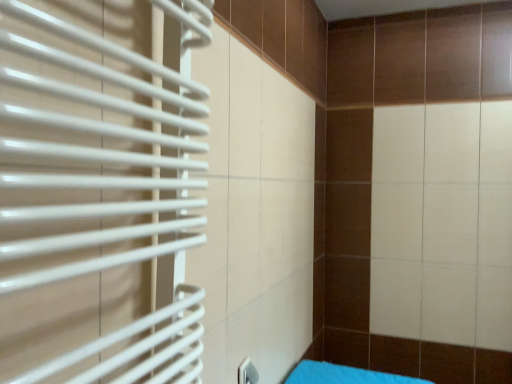
Measure the distance between point (161, 0) and camera.

The distance of point (161, 0) from camera is 79.20 centimeters.

The width and height of the screenshot is (512, 384). I want to click on white matte radiator at left, so tap(99, 193).

What is the approximate height of white matte radiator at left?

white matte radiator at left is 77.65 centimeters tall.

Describe the element at coordinates (99, 193) in the screenshot. The width and height of the screenshot is (512, 384). I see `white matte radiator at left` at that location.

What do you see at coordinates (344, 375) in the screenshot?
I see `blue fabric bed at lower right` at bounding box center [344, 375].

The height and width of the screenshot is (384, 512). Find the location of `blue fabric bed at lower right`. blue fabric bed at lower right is located at coordinates (344, 375).

You are a GUI agent. You are given a task and a screenshot of the screen. Output one action in this format:
    pyautogui.click(x=<x>, y=<y>)
    Task: Click on the white matte radiator at left
    The height and width of the screenshot is (384, 512).
    Given the screenshot: What is the action you would take?
    pyautogui.click(x=99, y=193)

Considering the relative positions of blue fabric bed at lower right and white matte radiator at left in the image provided, is blue fabric bed at lower right to the right of white matte radiator at left from the viewer's perspective?

Yes.

Considering the positions of objects blue fabric bed at lower right and white matte radiator at left in the image provided, who is behind, blue fabric bed at lower right or white matte radiator at left?

blue fabric bed at lower right is behind.

Which point is more distant from viewer, [365,375] or [128,351]?

The point [365,375] is farther from the camera.

From the image's perspective, is blue fabric bed at lower right under white matte radiator at left?

Yes.

Looking at this image, from a real-world perspective, does blue fabric bed at lower right stand above white matte radiator at left?

No, from a real-world perspective, blue fabric bed at lower right is not above white matte radiator at left.

Considering the sizes of blue fabric bed at lower right and white matte radiator at left in the image, is blue fabric bed at lower right wider or thinner than white matte radiator at left?

Clearly, blue fabric bed at lower right has more width compared to white matte radiator at left.

Between blue fabric bed at lower right and white matte radiator at left, which one has more height?

white matte radiator at left.

Based on the photo, considering the sizes of objects blue fabric bed at lower right and white matte radiator at left in the image provided, who is bigger, blue fabric bed at lower right or white matte radiator at left?

Bigger between the two is white matte radiator at left.

From the picture: Would you say blue fabric bed at lower right is outside white matte radiator at left?

That's correct, blue fabric bed at lower right is outside of white matte radiator at left.

Would you say blue fabric bed at lower right is a long distance from white matte radiator at left?

Yes, blue fabric bed at lower right and white matte radiator at left are located far from each other.

Is white matte radiator at left at the back of blue fabric bed at lower right?

blue fabric bed at lower right is not turned away from white matte radiator at left.

You are a GUI agent. You are given a task and a screenshot of the screen. Output one action in this format:
    pyautogui.click(x=<x>, y=<y>)
    Task: Click on the shutter that appears on the left of blue fabric bed at lower right
    
    Given the screenshot: What is the action you would take?
    pyautogui.click(x=99, y=193)

Between white matte radiator at left and blue fabric bed at lower right, which one appears on the left side from the viewer's perspective?

Positioned to the left is white matte radiator at left.

Between white matte radiator at left and blue fabric bed at lower right, which one is positioned behind?

blue fabric bed at lower right.

Considering the positions of point (168, 93) and point (321, 364), is point (168, 93) closer or farther from the camera than point (321, 364)?

Point (168, 93) is positioned closer to the camera compared to point (321, 364).

From the image's perspective, is white matte radiator at left positioned above or below blue fabric bed at lower right?

white matte radiator at left is situated higher than blue fabric bed at lower right in the image.

From a real-world perspective, is white matte radiator at left located beneath blue fabric bed at lower right?

No, from a real-world perspective, white matte radiator at left is not below blue fabric bed at lower right.

Which of these two, white matte radiator at left or blue fabric bed at lower right, is thinner?

With smaller width is white matte radiator at left.

Is white matte radiator at left taller or shorter than blue fabric bed at lower right?

white matte radiator at left is taller than blue fabric bed at lower right.

Considering the relative sizes of white matte radiator at left and blue fabric bed at lower right in the image provided, is white matte radiator at left bigger than blue fabric bed at lower right?

Indeed, white matte radiator at left has a larger size compared to blue fabric bed at lower right.

Which is correct: white matte radiator at left is inside blue fabric bed at lower right, or outside of it?

white matte radiator at left exists outside the volume of blue fabric bed at lower right.

Is white matte radiator at left not close to blue fabric bed at lower right?

That's right, there is a large distance between white matte radiator at left and blue fabric bed at lower right.

Could you tell me if white matte radiator at left is facing blue fabric bed at lower right?

No, white matte radiator at left is not turned towards blue fabric bed at lower right.

How many degrees apart are the facing directions of white matte radiator at left and blue fabric bed at lower right?

There is a 0.316-degree angle between the facing directions of white matte radiator at left and blue fabric bed at lower right.

In order to click on furniture below the white matte radiator at left (from the image's perspective) in this screenshot , I will do `click(344, 375)`.

The width and height of the screenshot is (512, 384). I want to click on shutter above the blue fabric bed at lower right (from the image's perspective), so click(x=99, y=193).

Identify the location of furniture on the right of the white matte radiator at left. The width and height of the screenshot is (512, 384). (344, 375).